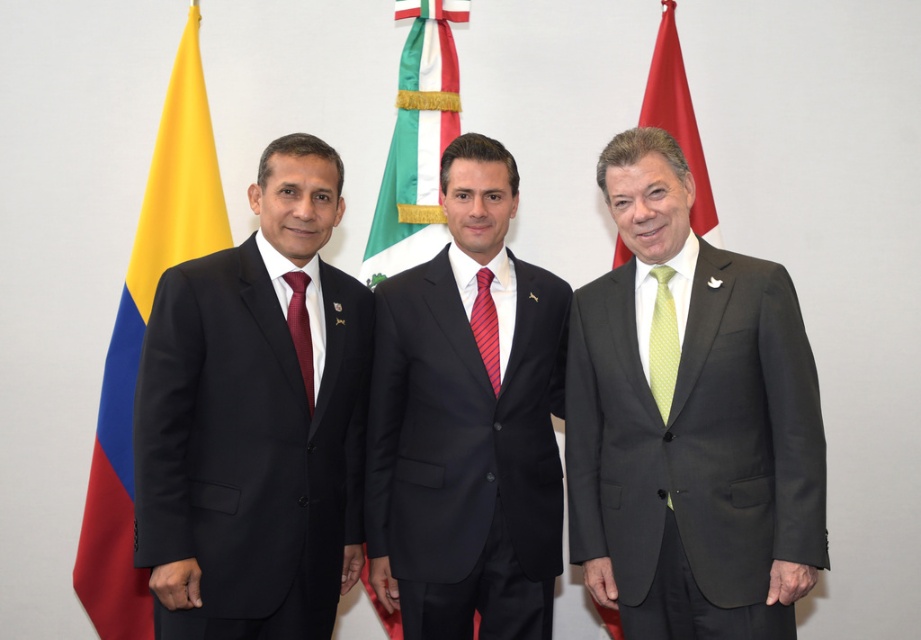
Is green silk flag at center smaller than red striped tie at center?

Actually, green silk flag at center might be larger than red striped tie at center.

I want to click on green silk flag at center, so click(417, 141).

Find the location of `green silk flag at center`. green silk flag at center is located at coordinates (417, 141).

Between matte gray suit at right and red striped tie at center, which one appears on the left side from the viewer's perspective?

red striped tie at center is more to the left.

Is point (714, 474) closer to camera compared to point (476, 337)?

Yes, it is in front of point (476, 337).

Is point (636, 168) in front of point (498, 388)?

Yes, it is in front of point (498, 388).

The width and height of the screenshot is (921, 640). Identify the location of matte gray suit at right. (690, 424).

Who is positioned more to the left, matte gray suit at right or yellow matte flag at left?

Positioned to the left is yellow matte flag at left.

Find the location of `matte gray suit at right`. matte gray suit at right is located at coordinates (690, 424).

Between point (739, 280) and point (219, 224), which one is positioned in front?

Point (739, 280)

Find the location of a particular element. matte gray suit at right is located at coordinates pyautogui.click(x=690, y=424).